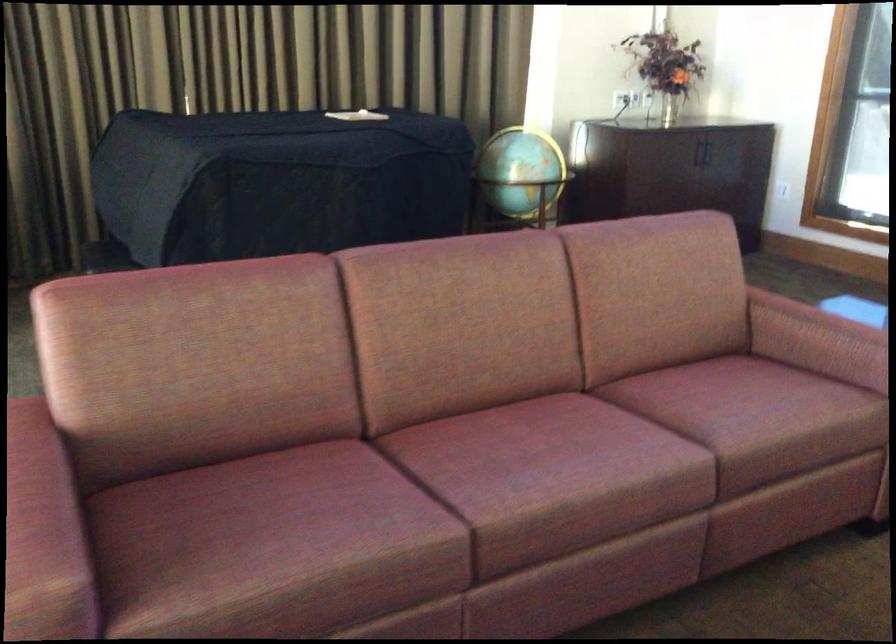
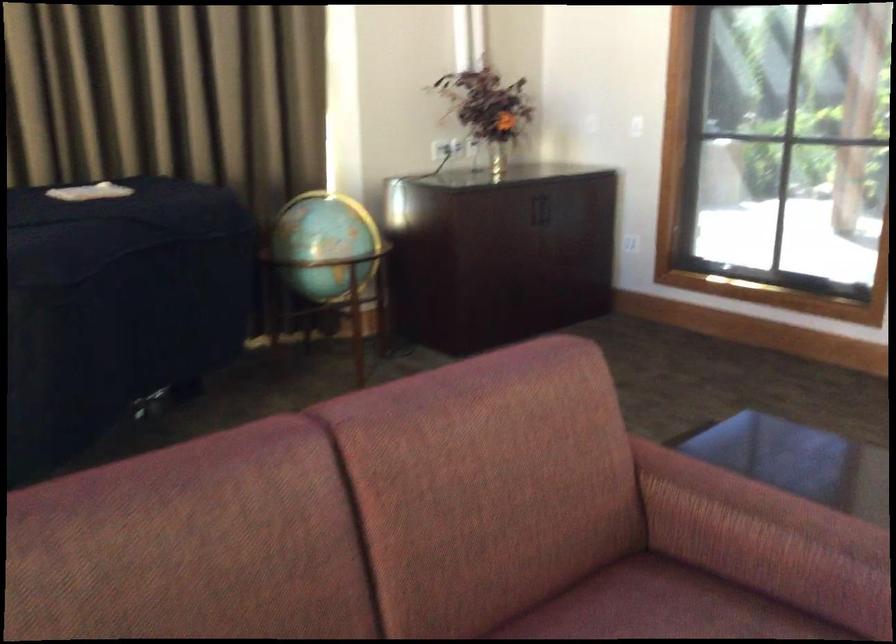
Question: What movement of the cameraman would produce the second image?

Choices:
 (A) Left
 (B) Right
 (C) Forward
 (D) Backward

Answer: (C)